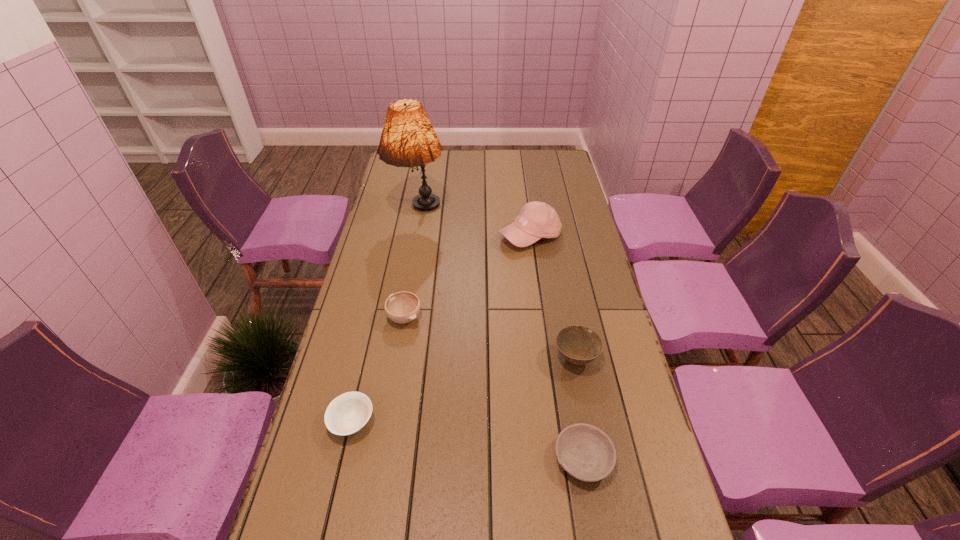
You are a GUI agent. You are given a task and a screenshot of the screen. Output one action in this format:
    pyautogui.click(x=<x>, y=<y>)
    Task: Click on the tallest object
    The width and height of the screenshot is (960, 540).
    Given the screenshot: What is the action you would take?
    pyautogui.click(x=408, y=139)

The width and height of the screenshot is (960, 540). Identify the location of the second tallest object. (537, 220).

Where is `the third nearest bowl`? The image size is (960, 540). the third nearest bowl is located at coordinates (579, 345).

Identify the location of the fourth farthest object. (579, 345).

The width and height of the screenshot is (960, 540). Identify the location of the fourth nearest object. (402, 307).

I want to click on the third shortest bowl, so click(x=402, y=307).

At what (x,y) coordinates should I click in order to perform the action: click on the shortest object. Please return your answer as a coordinate pair (x, y). The width and height of the screenshot is (960, 540). Looking at the image, I should click on (586, 452).

This screenshot has width=960, height=540. I want to click on vacant area located 0.090m on the front-facing side of the tallest object, so click(412, 251).

I want to click on blank space located on the front-facing side of the fifth shortest object, so click(542, 330).

This screenshot has width=960, height=540. Find the location of `free spot located on the left of the tallest bowl`. free spot located on the left of the tallest bowl is located at coordinates [x=525, y=359].